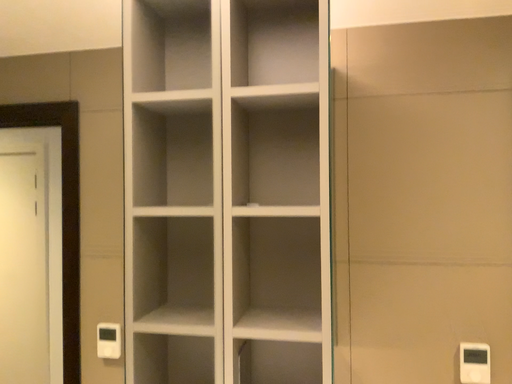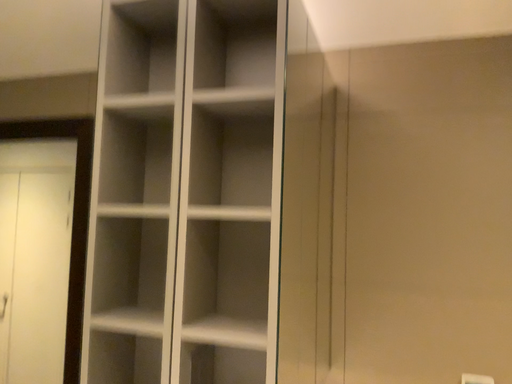
Question: How did the camera likely rotate when shooting the video?

Choices:
 (A) rotated right
 (B) rotated left

Answer: (B)